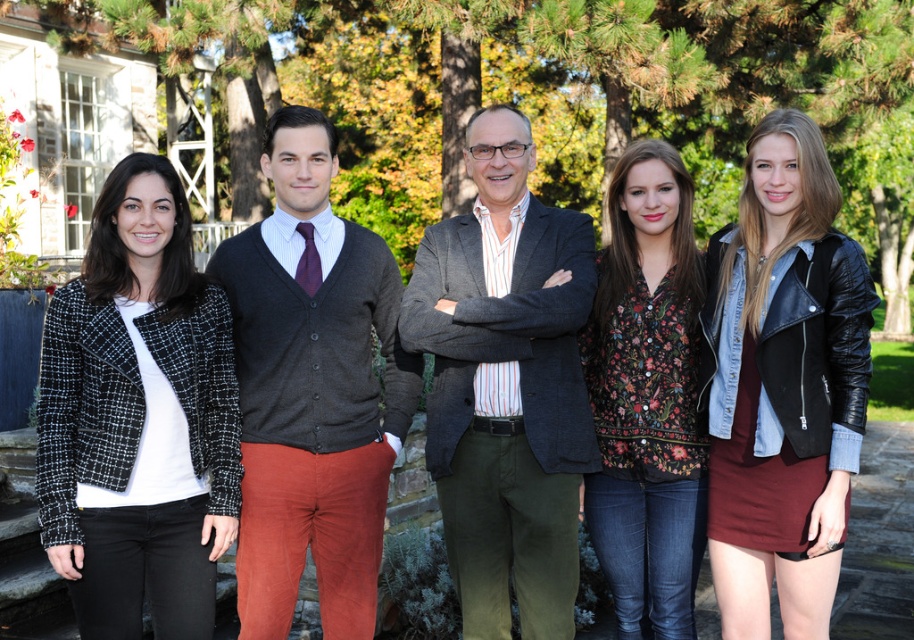
Based on the photo, who is higher up, dark gray textured blazer at center or dark gray wool sweater at center?

dark gray textured blazer at center is higher up.

Does point (449, 566) come closer to viewer compared to point (285, 336)?

No, (449, 566) is behind (285, 336).

Does point (452, 563) come closer to viewer compared to point (289, 264)?

That is False.

You are a GUI agent. You are given a task and a screenshot of the screen. Output one action in this format:
    pyautogui.click(x=<x>, y=<y>)
    Task: Click on the dark gray textured blazer at center
    The image size is (914, 640).
    Given the screenshot: What is the action you would take?
    pyautogui.click(x=506, y=385)

Image resolution: width=914 pixels, height=640 pixels. What do you see at coordinates (506, 385) in the screenshot? I see `dark gray textured blazer at center` at bounding box center [506, 385].

Is point (562, 289) closer to camera compared to point (645, 214)?

Yes, point (562, 289) is in front of point (645, 214).

Measure the distance between point (516, 198) and camera.

Point (516, 198) is 4.27 meters from camera.

You are a GUI agent. You are given a task and a screenshot of the screen. Output one action in this format:
    pyautogui.click(x=<x>, y=<y>)
    Task: Click on the dark gray textured blazer at center
    
    Given the screenshot: What is the action you would take?
    pyautogui.click(x=506, y=385)

You are a GUI agent. You are given a task and a screenshot of the screen. Output one action in this format:
    pyautogui.click(x=<x>, y=<y>)
    Task: Click on the black tweed jacket at left
    
    Given the screenshot: What is the action you would take?
    pyautogui.click(x=137, y=417)

Is point (126, 396) more distant than point (320, 419)?

No, (126, 396) is in front of (320, 419).

Identify the location of black tweed jacket at left. This screenshot has width=914, height=640. (137, 417).